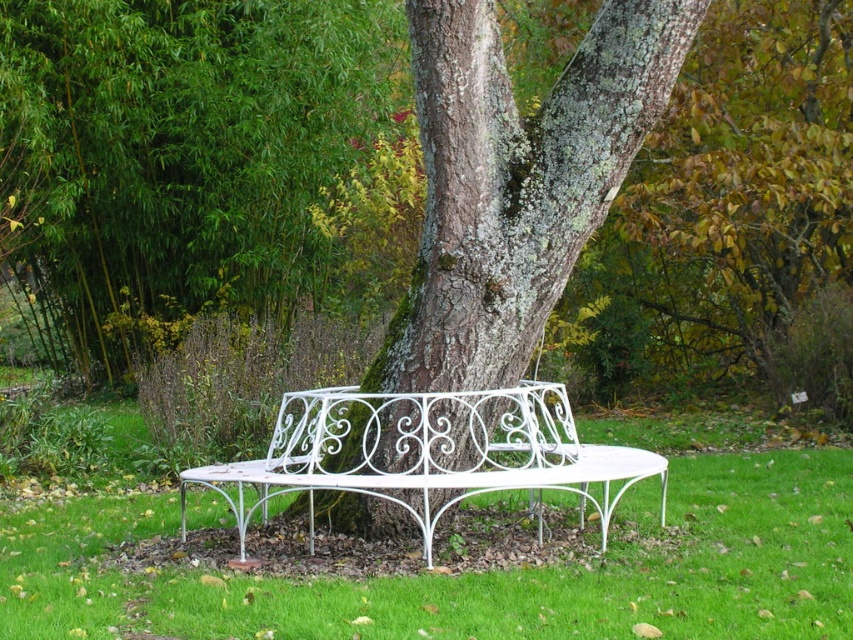
Question: Can you confirm if green bamboo at left is smaller than white wrought iron bench at center?

Choices:
 (A) no
 (B) yes

Answer: (A)

Question: Which point is closer to the camera?

Choices:
 (A) (624, 445)
 (B) (111, 301)
 (C) (462, 177)

Answer: (C)

Question: Which of the following is the closest to the observer?

Choices:
 (A) (36, 234)
 (B) (354, 508)

Answer: (B)

Question: Considering the relative positions of green bamboo at left and white wrought iron bench at center in the image provided, where is green bamboo at left located with respect to white wrought iron bench at center?

Choices:
 (A) right
 (B) left

Answer: (B)

Question: Does green bamboo at left lie behind white wrought iron bench at center?

Choices:
 (A) yes
 (B) no

Answer: (A)

Question: Which object is the farthest from the green mossy bark at center?

Choices:
 (A) white wrought iron bench at center
 (B) green bamboo at left

Answer: (B)